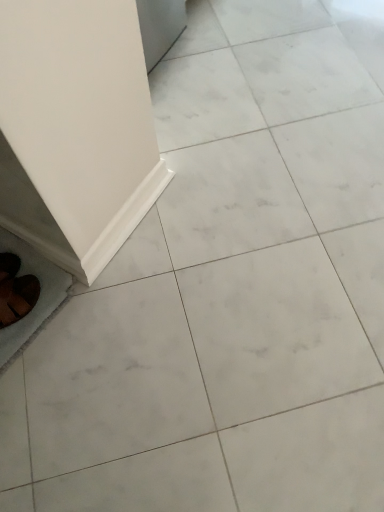
Identify the location of free location to the right of white glossy baseboard at lower left, which appears as the 1th ceramic tile when viewed from the right. The height and width of the screenshot is (512, 384). (205, 217).